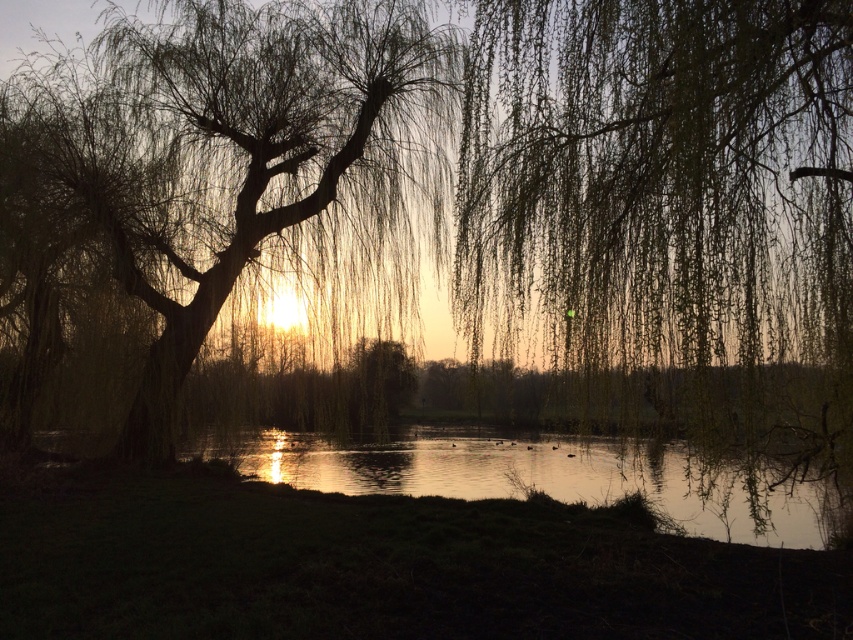
Question: Which point appears farthest from the camera in this image?

Choices:
 (A) (659, 144)
 (B) (270, 198)

Answer: (B)

Question: Is green leafy willow at center positioned before silvery branches willow at center?

Choices:
 (A) no
 (B) yes

Answer: (B)

Question: Where is green leafy willow at center located in relation to silvery branches willow at center in the image?

Choices:
 (A) below
 (B) above

Answer: (A)

Question: Where is green leafy willow at center located in relation to silvery branches willow at center in the image?

Choices:
 (A) left
 (B) right

Answer: (B)

Question: Which object appears farthest from the camera in this image?

Choices:
 (A) green leafy willow at center
 (B) silvery branches willow at center

Answer: (B)

Question: Which of the following is the closest to the observer?

Choices:
 (A) silvery branches willow at center
 (B) green leafy willow at center

Answer: (B)